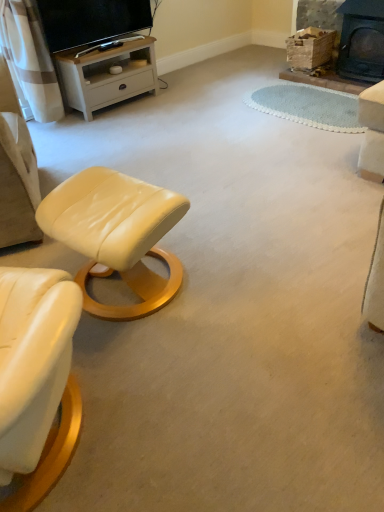
Question: Is point click(x=345, y=56) positioned closer to the camera than point click(x=119, y=100)?

Choices:
 (A) farther
 (B) closer

Answer: (A)

Question: Is black cast iron fireplace at upper right taller or shorter than white wood tv stand at upper left?

Choices:
 (A) short
 (B) tall

Answer: (B)

Question: Which object is positioned farthest from the black cast iron fireplace at upper right?

Choices:
 (A) matte black tv at upper left
 (B) white wood tv stand at upper left
 (C) matte cream leather stool at lower left

Answer: (C)

Question: Estimate the real-world distances between objects in this image. Which object is closer to the matte black tv at upper left?

Choices:
 (A) white wood tv stand at upper left
 (B) black cast iron fireplace at upper right
 (C) matte cream leather stool at lower left

Answer: (A)